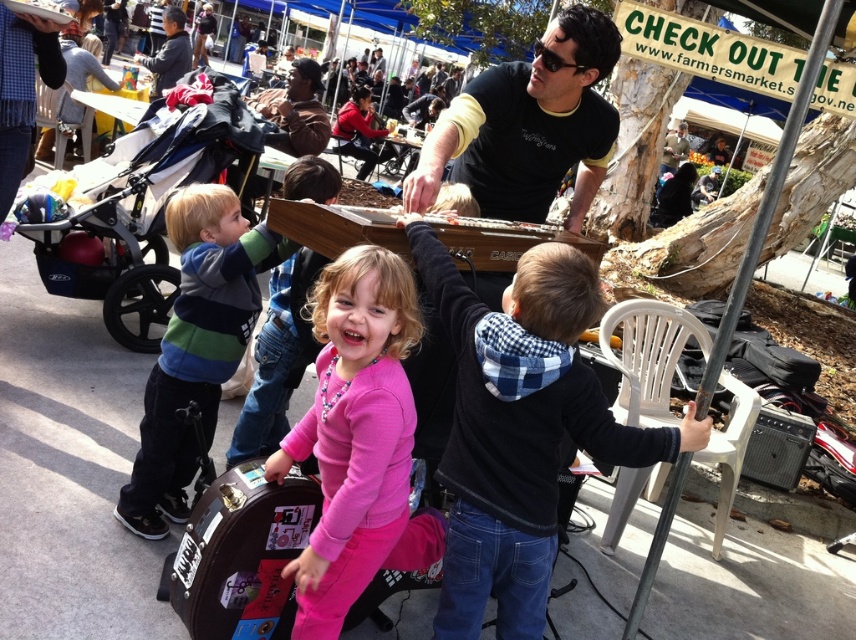
Is black matte shirt at upper center shorter than matte black jacket at upper left?

Correct, black matte shirt at upper center is not as tall as matte black jacket at upper left.

Does black matte shirt at upper center lie in front of matte black jacket at upper left?

Yes.

At what (x,y) coordinates should I click in order to perform the action: click on black matte shirt at upper center. Please return your answer as a coordinate pair (x, y). Looking at the image, I should click on (528, 125).

I want to click on black matte shirt at upper center, so click(x=528, y=125).

Is plaid hoodie at center to the left of black matte shirt at upper center from the viewer's perspective?

Incorrect, plaid hoodie at center is not on the left side of black matte shirt at upper center.

Between point (479, 420) and point (568, 225), which one is positioned in front?

Positioned in front is point (479, 420).

You are a GUI agent. You are given a task and a screenshot of the screen. Output one action in this format:
    pyautogui.click(x=<x>, y=<y>)
    Task: Click on the plaid hoodie at center
    
    Given the screenshot: What is the action you would take?
    pyautogui.click(x=520, y=428)

Who is lower down, plaid hoodie at center or pink matte dress at center?

plaid hoodie at center is below.

Which of these two, plaid hoodie at center or pink matte dress at center, stands taller?

plaid hoodie at center

Is point (400, 224) positioned in front of point (324, 477)?

No.

Identify the location of plaid hoodie at center. This screenshot has height=640, width=856. (520, 428).